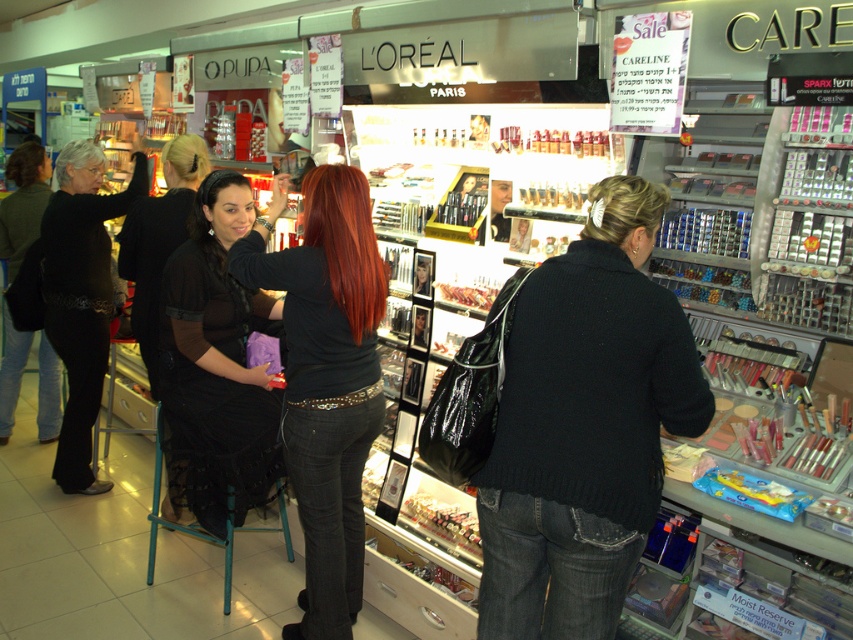
Looking at this image, which is more to the right, black lace belt at left or shiny orange hair at center?

From the viewer's perspective, shiny orange hair at center appears more on the right side.

Is point (97, 356) farther from viewer compared to point (369, 236)?

Yes, it is.

Find the location of `black lace belt at left`. black lace belt at left is located at coordinates (80, 296).

Is blonde hair at center to the left of gray matte hair at upper left from the viewer's perspective?

No, blonde hair at center is not to the left of gray matte hair at upper left.

Does blonde hair at center have a greater width compared to gray matte hair at upper left?

No.

Describe the element at coordinates (186, 157) in the screenshot. I see `blonde hair at center` at that location.

You are a GUI agent. You are given a task and a screenshot of the screen. Output one action in this format:
    pyautogui.click(x=<x>, y=<y>)
    Task: Click on the blonde hair at center
    Image resolution: width=853 pixels, height=640 pixels.
    Given the screenshot: What is the action you would take?
    pyautogui.click(x=186, y=157)

Is matte black shirt at center to the right of blonde hair at upper left from the viewer's perspective?

Indeed, matte black shirt at center is positioned on the right side of blonde hair at upper left.

Is matte black shirt at center shorter than blonde hair at upper left?

In fact, matte black shirt at center may be taller than blonde hair at upper left.

Find the location of a particular element. matte black shirt at center is located at coordinates point(326,380).